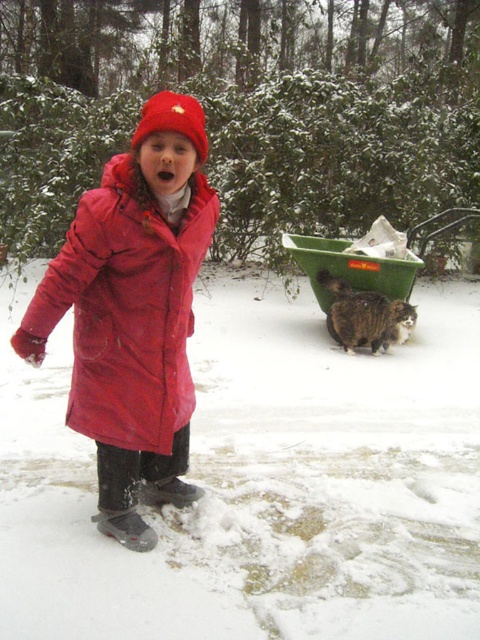
Question: Which point is closer to the camera taking this photo?

Choices:
 (A) (180, 390)
 (B) (160, 104)

Answer: (B)

Question: Among these objects, which one is farthest from the camera?

Choices:
 (A) green plastic cart at lower right
 (B) red fleece hat at center
 (C) matte red coat at center

Answer: (A)

Question: Is matte red coat at center further to camera compared to red fleece hat at center?

Choices:
 (A) yes
 (B) no

Answer: (A)

Question: Does matte red coat at center appear on the right side of green plastic cart at lower right?

Choices:
 (A) no
 (B) yes

Answer: (A)

Question: Based on their relative distances, which object is nearer to the red fleece hat at center?

Choices:
 (A) green plastic cart at lower right
 (B) matte red coat at center

Answer: (B)

Question: Does matte red coat at center have a smaller size compared to green plastic cart at lower right?

Choices:
 (A) no
 (B) yes

Answer: (B)